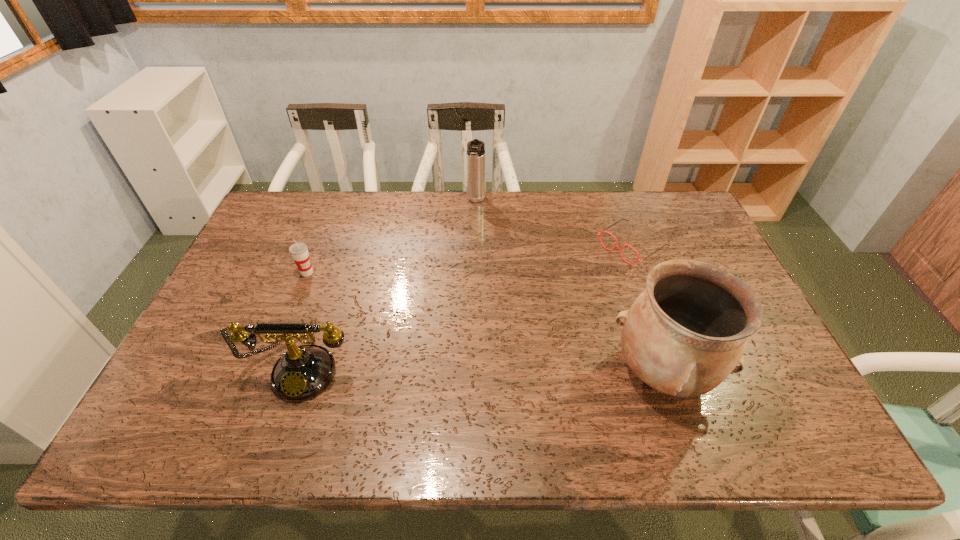
The height and width of the screenshot is (540, 960). I want to click on telephone, so click(x=302, y=372).

Identify the location of the tallest object. (685, 333).

Where is `the shortest object`? The image size is (960, 540). the shortest object is located at coordinates (620, 249).

You are a GUI agent. You are given a task and a screenshot of the screen. Output one action in this format:
    pyautogui.click(x=<x>, y=<y>)
    Task: Click on the cup
    Image resolution: width=960 pixels, height=540 pixels.
    Given the screenshot: What is the action you would take?
    pyautogui.click(x=299, y=252)

Image resolution: width=960 pixels, height=540 pixels. Find the location of `thermos bottle`. thermos bottle is located at coordinates pos(476,189).

Locate an element on the screen. Image resolution: width=960 pixels, height=540 pixels. the farthest object is located at coordinates (476, 189).

You are a GUI agent. You are given a task and a screenshot of the screen. Output one action in this format:
    pyautogui.click(x=<x>, y=<y>)
    Task: Click on the vacant space located on the left of the urn
    This screenshot has height=540, width=960.
    Given the screenshot: What is the action you would take?
    click(515, 372)

I want to click on free space located on the front-facing side of the spectacles, so click(524, 315).

Find the location of a particular element. free spot located on the front-facing side of the spectacles is located at coordinates (593, 271).

Where is `vacant area situated 0.320m on the front-facing side of the spectacles`? The width and height of the screenshot is (960, 540). vacant area situated 0.320m on the front-facing side of the spectacles is located at coordinates (533, 310).